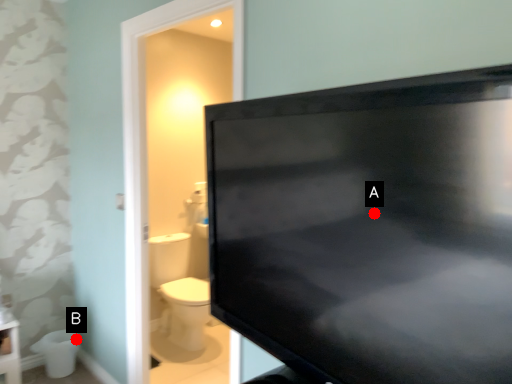
Question: Two points are circled on the image, labeled by A and B beside each circle. Which point is further to the camera?

Choices:
 (A) A is further
 (B) B is further

Answer: (B)